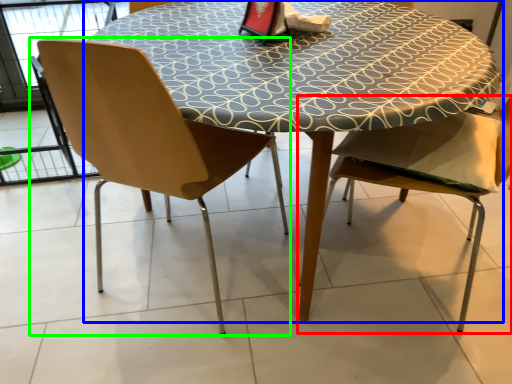
Question: Based on their relative distances, which object is farther from chair (highlighted by a red box)? Choose from table (highlighted by a blue box) and chair (highlighted by a green box).

Choices:
 (A) table
 (B) chair

Answer: (B)